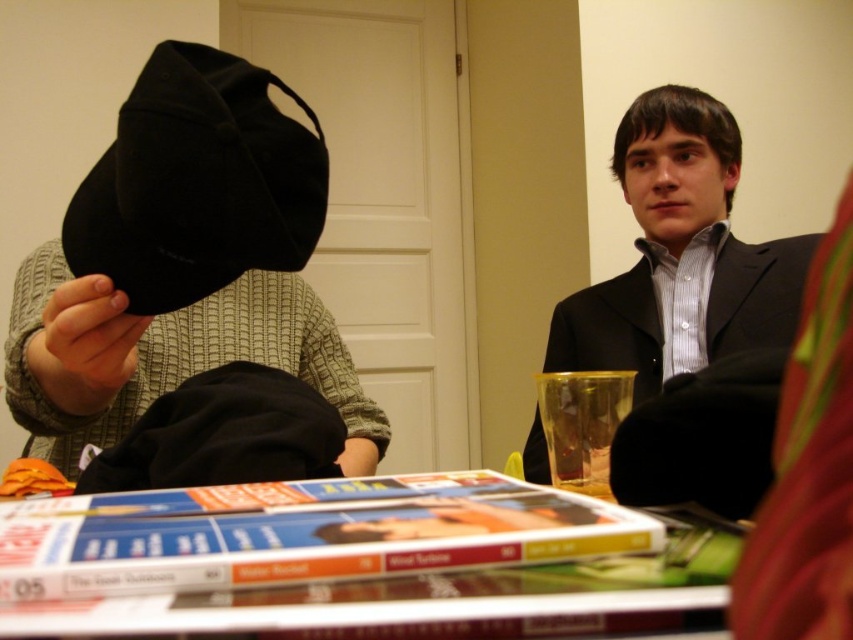
Question: Which of the following is the closest to the observer?

Choices:
 (A) (294, 189)
 (B) (106, 305)
 (C) (1, 564)
 (D) (781, 320)

Answer: (C)

Question: Based on their relative distances, which object is farther from the black matte suit at upper right?

Choices:
 (A) translucent plastic cup at lower center
 (B) matte black cap at left
 (C) black velvet cap at upper left
 (D) matte plastic magazines at center

Answer: (C)

Question: Does black velvet cap at upper left appear over black matte suit at upper right?

Choices:
 (A) yes
 (B) no

Answer: (A)

Question: Which object is closer to the camera taking this photo?

Choices:
 (A) matte black cap at left
 (B) translucent plastic cup at lower center

Answer: (A)

Question: Is black matte suit at upper right closer to the viewer compared to translucent plastic cup at lower center?

Choices:
 (A) no
 (B) yes

Answer: (A)

Question: From the image, what is the correct spatial relationship of black velvet cap at upper left in relation to black matte suit at upper right?

Choices:
 (A) above
 (B) below

Answer: (A)